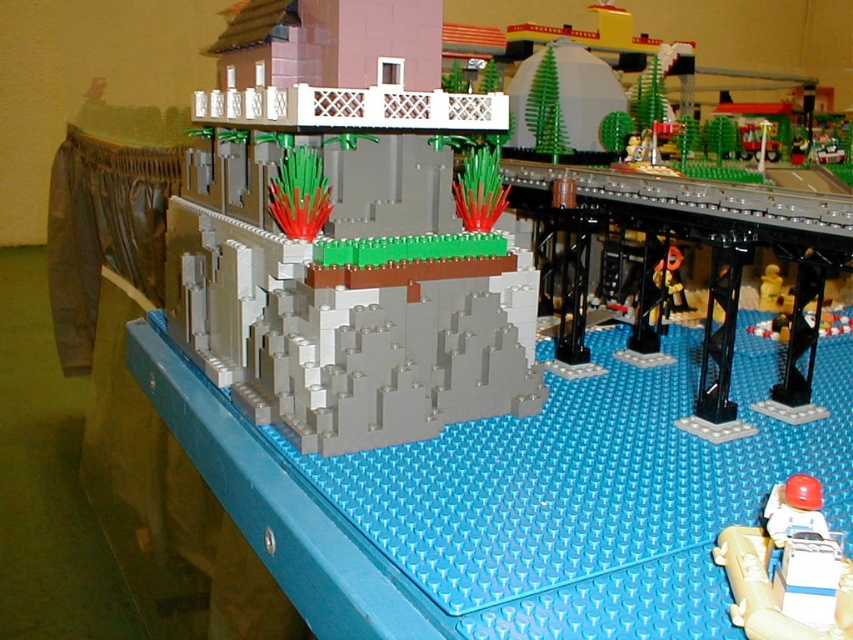
Question: Which is farther from the matte yellow figure at center-right?

Choices:
 (A) white plastic figure at lower right
 (B) gray matte rock formation at center

Answer: (A)

Question: Estimate the real-world distances between objects in this image. Which object is closer to the white plastic figure at lower right?

Choices:
 (A) gray matte rock formation at center
 (B) matte yellow figure at center-right
 (C) yellow plastic figure at center-right

Answer: (A)

Question: Does gray matte rock formation at center have a lesser width compared to matte yellow figure at center-right?

Choices:
 (A) yes
 (B) no

Answer: (B)

Question: Is white plastic figure at lower right wider than yellow plastic figure at center-right?

Choices:
 (A) yes
 (B) no

Answer: (A)

Question: In this image, where is gray matte rock formation at center located relative to matte yellow figure at center-right?

Choices:
 (A) above
 (B) below

Answer: (A)

Question: Among these objects, which one is nearest to the camera?

Choices:
 (A) gray matte rock formation at center
 (B) white plastic figure at lower right
 (C) matte yellow figure at center-right

Answer: (B)